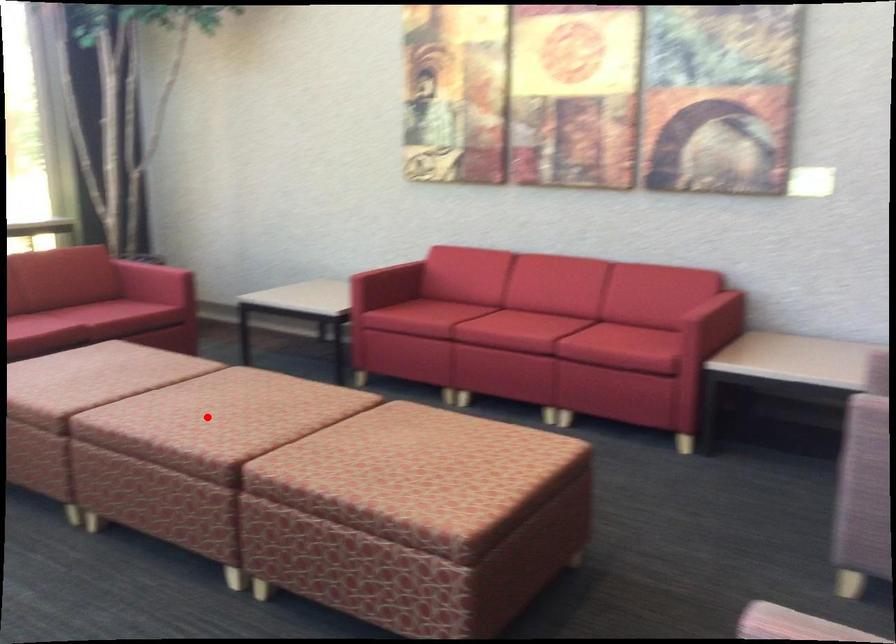
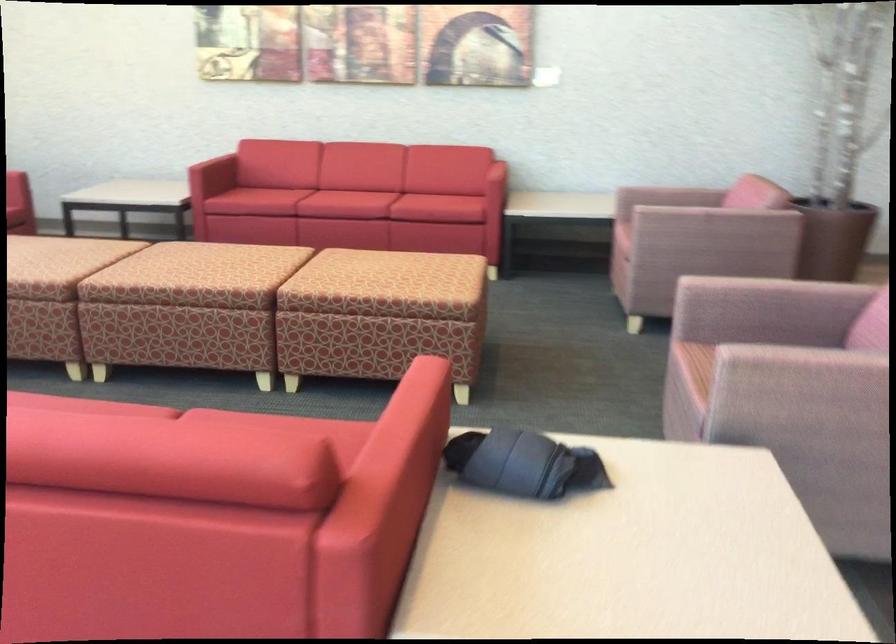
Where in the second image is the point corresponding to the highlighted location from the first image?

(186, 263)